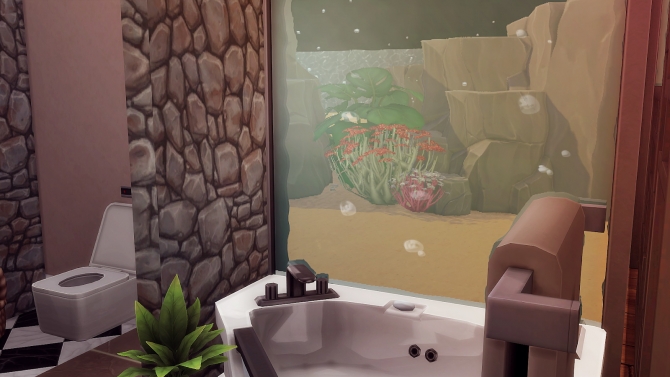
You are a GUI agent. You are given a task and a screenshot of the screen. Output one action in this format:
    pyautogui.click(x=<x>, y=<y>)
    Task: Click on the green leaf plant
    
    Given the screenshot: What is the action you would take?
    pyautogui.click(x=169, y=343)